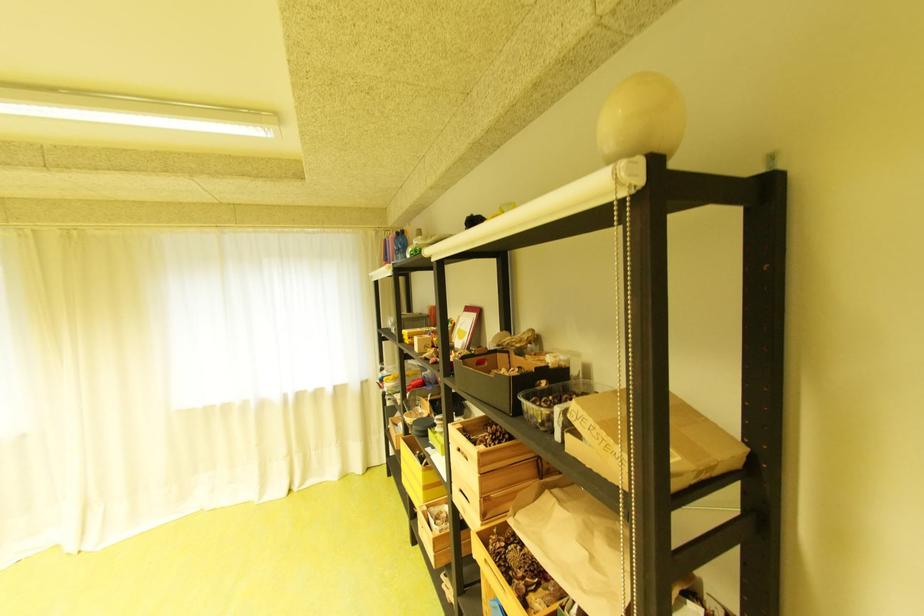
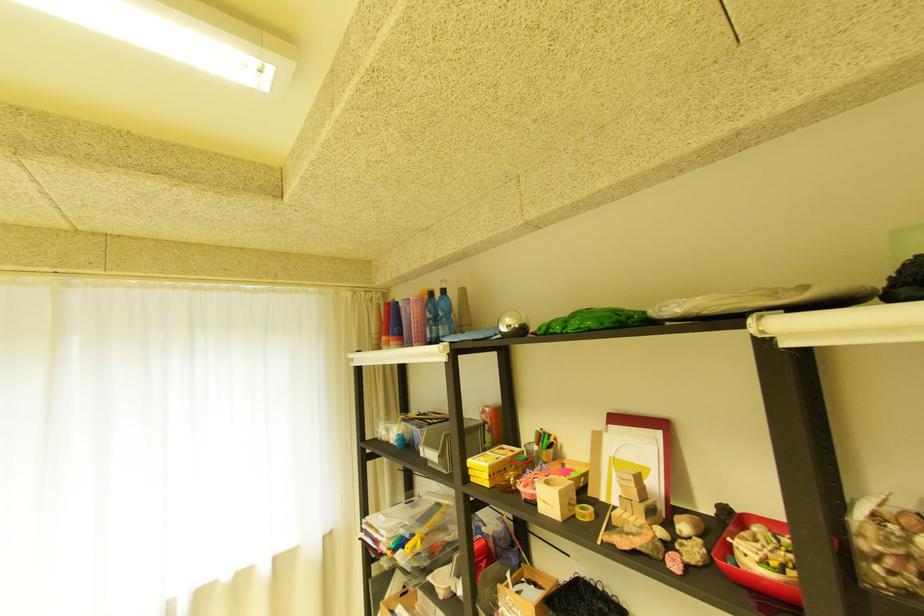
The images are taken continuously from a first-person perspective. In which direction are you moving?

The cameraman moved toward left, forward.